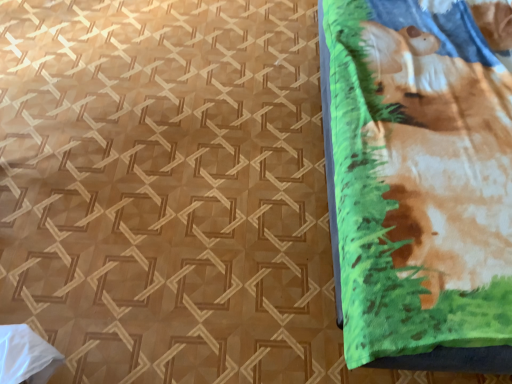
In order to face fluffy beige dog at right, should I rotate leftwards or rightwards?

Rotate right and turn 24.996 degrees.

Image resolution: width=512 pixels, height=384 pixels. What do you see at coordinates (444, 159) in the screenshot? I see `fluffy beige dog at right` at bounding box center [444, 159].

Locate an element on the screen. The width and height of the screenshot is (512, 384). fluffy beige dog at right is located at coordinates (444, 159).

You are a GUI agent. You are given a task and a screenshot of the screen. Output one action in this format:
    pyautogui.click(x=<x>, y=<y>)
    Task: Click on the fluffy beige dog at right
    
    Given the screenshot: What is the action you would take?
    444,159